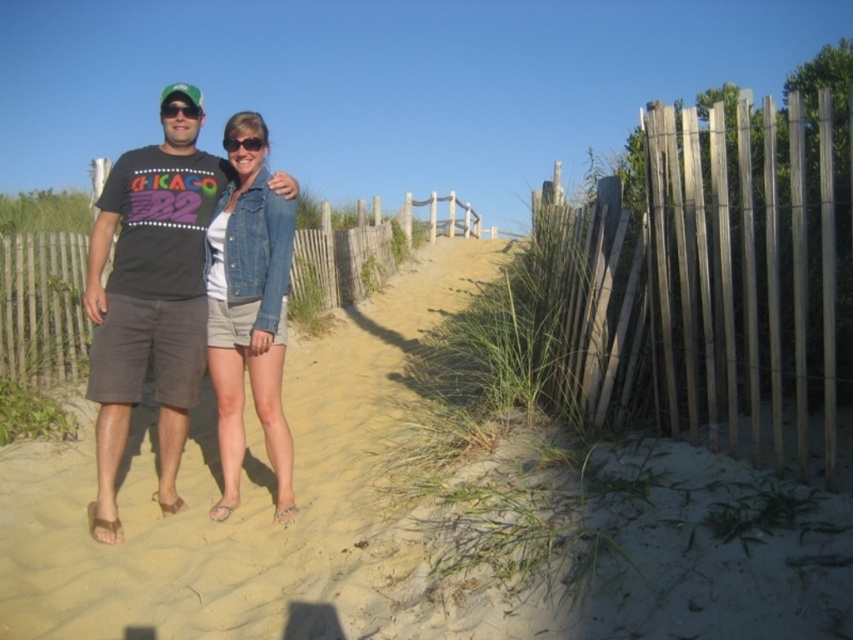
You are a photographer trying to capture a closeup shot of the green matte sunglasses at center. The camera has a zoom range of 50mm. Given that the sunglasses are located at coordinates point 0.172, 0.211, can you determine if the camera can focus on them?

The green matte sunglasses at center are located at point (178, 109). Since the camera has a zoom range of 50mm, it can focus on objects within its field of view. However, the exact focus capability depends on the camera model and lens quality. Assuming standard settings, the camera should be able to focus on the green matte sunglasses at center at that point.

Consider the image. You are standing at the wooden fence in the background and want to walk to the beige sandy path at center. Which direction should you go to reach it?

Since the beige sandy path at center is located at point (395, 522), you should walk towards the center of the image to reach it from the wooden fence in the background.